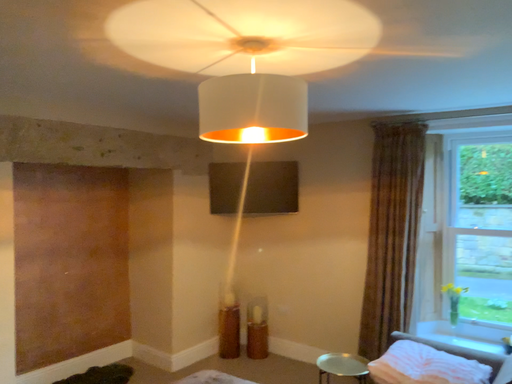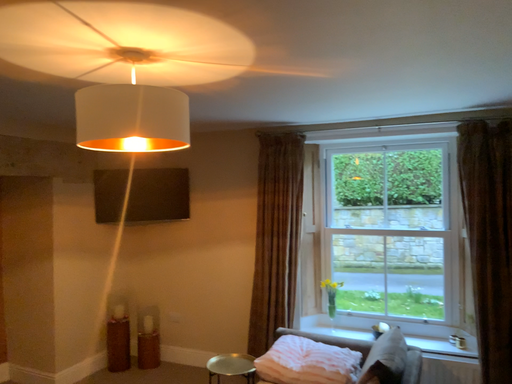
Question: Which way did the camera rotate in the video?

Choices:
 (A) rotated left
 (B) rotated right

Answer: (B)